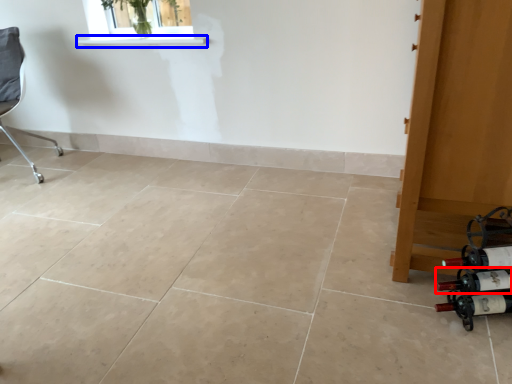
Question: Which point is further to the camera, wine bottle (highlighted by a red box) or window sill (highlighted by a blue box)?

Choices:
 (A) wine bottle
 (B) window sill

Answer: (B)